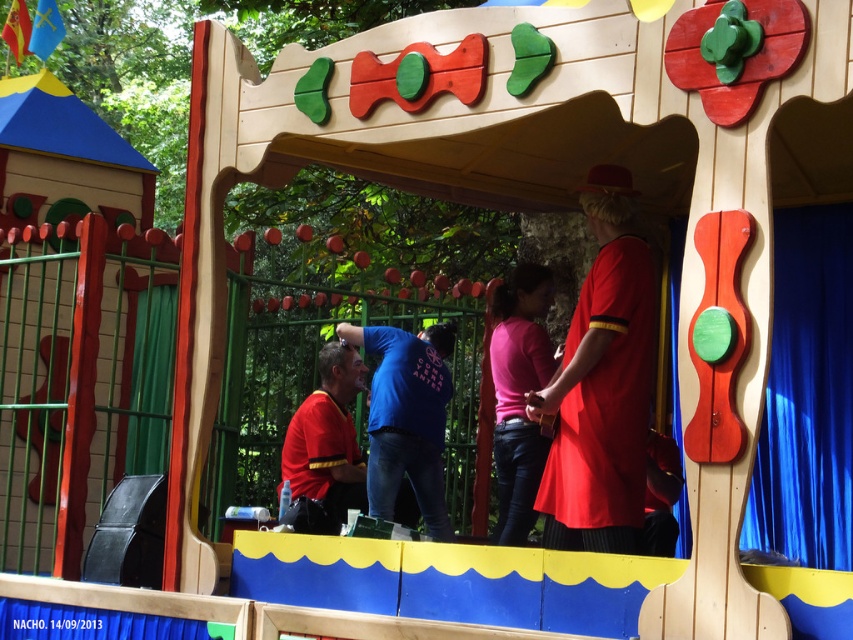
Can you confirm if matte red dress at center is positioned above blue cotton shirt at center?

Indeed, matte red dress at center is positioned over blue cotton shirt at center.

In the scene shown: Which is below, matte red dress at center or blue cotton shirt at center?

blue cotton shirt at center

Is point (560, 394) farther from camera compared to point (397, 364)?

No, (560, 394) is in front of (397, 364).

This screenshot has height=640, width=853. Find the location of `matte red dress at center`. matte red dress at center is located at coordinates (601, 385).

Who is lower down, matte red dress at center or pink matte shirt at center?

pink matte shirt at center

Which is above, matte red dress at center or pink matte shirt at center?

matte red dress at center is higher up.

Does point (631, 474) lie in front of point (537, 486)?

Yes, it is in front of point (537, 486).

In order to click on matte red dress at center in this screenshot , I will do `click(601, 385)`.

Is matte red dress at center closer to camera compared to matte red shirt at center?

Yes.

Can you confirm if matte red dress at center is positioned to the right of matte red shirt at center?

Indeed, matte red dress at center is positioned on the right side of matte red shirt at center.

Does point (595, 340) come farther from viewer compared to point (349, 355)?

No, it is in front of (349, 355).

You are a GUI agent. You are given a task and a screenshot of the screen. Output one action in this format:
    pyautogui.click(x=<x>, y=<y>)
    Task: Click on the matte red dress at center
    
    Given the screenshot: What is the action you would take?
    pyautogui.click(x=601, y=385)